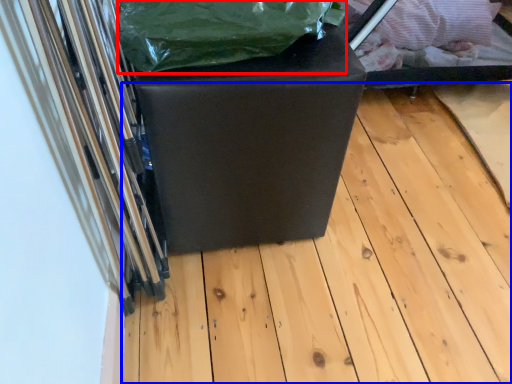
Question: Which of the following is the farthest to the observer, waste (highlighted by a red box) or wood (highlighted by a blue box)?

Choices:
 (A) waste
 (B) wood

Answer: (B)